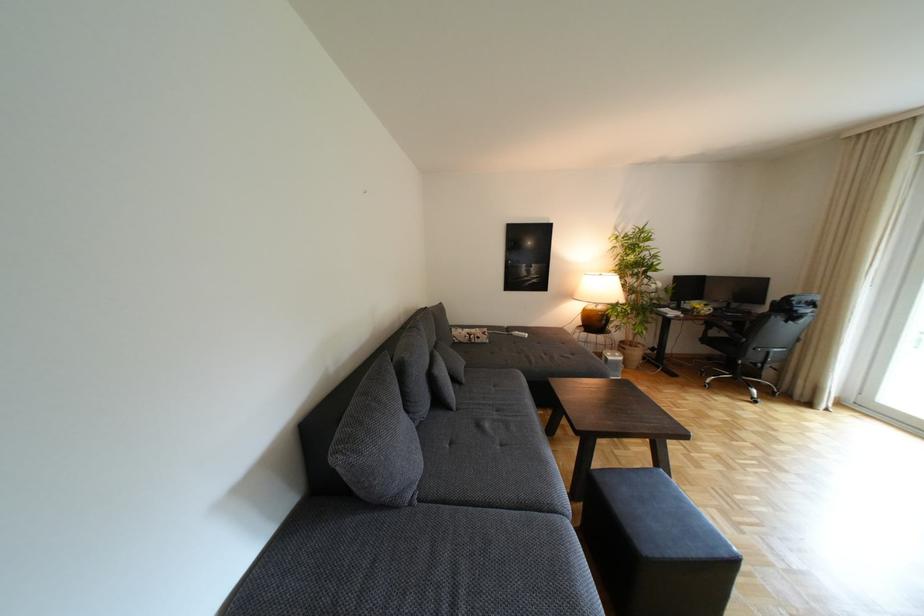
Which object does [659,515] point to?

It refers to a dark ottoman.